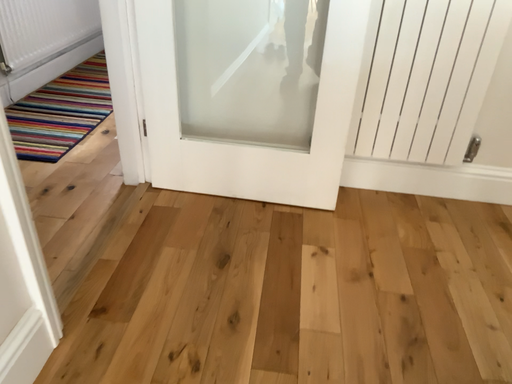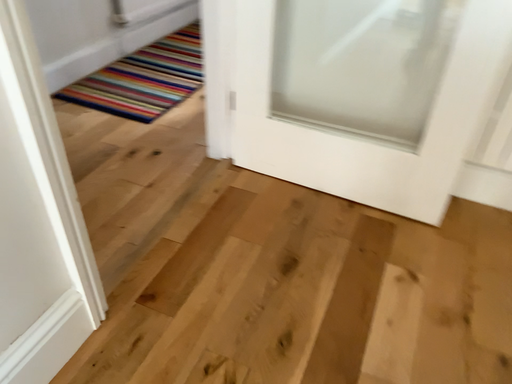
Question: Which way did the camera rotate in the video?

Choices:
 (A) rotated left
 (B) rotated right

Answer: (A)